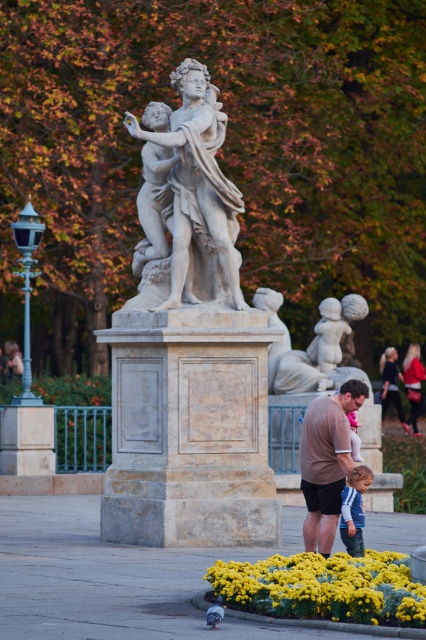
Looking at this image, you are a photographer standing in the park and want to capture a clear photo of the gray matte pigeon at lower center without the matte red coat at lower right blocking it. How should you adjust your position?

The matte red coat at lower right is positioned over the gray matte pigeon at lower center. To avoid the coat blocking the pigeon, move your camera position so that the coat is no longer in front of the pigeon, perhaps by shifting to the left or right to get a clear view of the pigeon without the coat obstructing it.

You are standing at the statue and want to walk to the point marked by point (215, 602). There is an obstacle at point (412, 384). Will you be able to see the obstacle from your current position?

Point (412, 384) is behind point (215, 602), so if you are facing towards point (215, 602), you will not be able to see the obstacle at point (412, 384) because it is located behind your destination point.